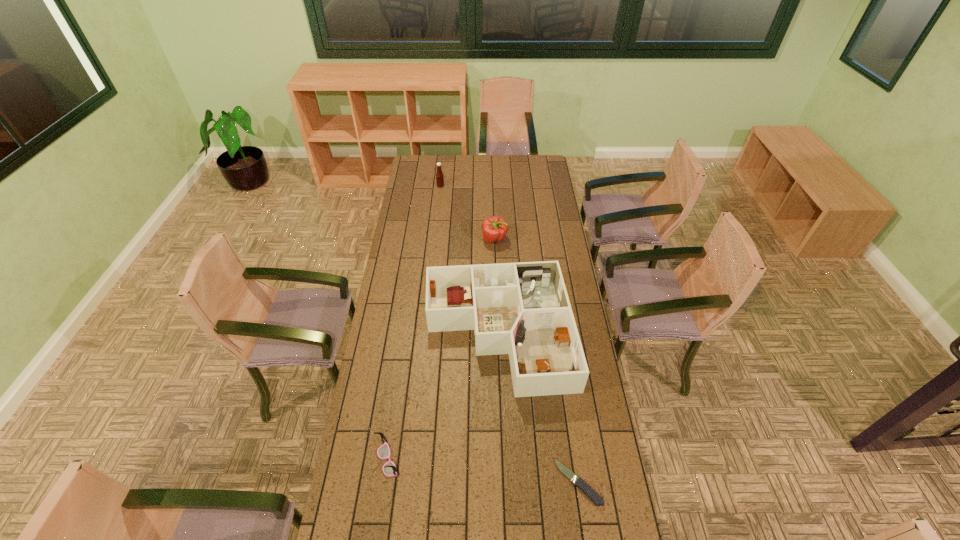
Where is `Tabasco sauce`? The image size is (960, 540). Tabasco sauce is located at coordinates (439, 175).

You are a GUI agent. You are given a task and a screenshot of the screen. Output one action in this format:
    pyautogui.click(x=<x>, y=<y>)
    Task: Click on the dollhouse
    
    Given the screenshot: What is the action you would take?
    pyautogui.click(x=522, y=309)

Locate an element on the screen. The height and width of the screenshot is (540, 960). the fourth nearest object is located at coordinates (494, 229).

The width and height of the screenshot is (960, 540). What are the coordinates of `the leftmost object` in the screenshot? It's located at (389, 469).

The image size is (960, 540). What are the coordinates of `the second shortest object` in the screenshot? It's located at (389, 469).

Locate an element on the screen. This screenshot has width=960, height=540. steak knife is located at coordinates (583, 486).

Find the location of `vacant point located 0.400m on the right of the Tabasco sauce`. vacant point located 0.400m on the right of the Tabasco sauce is located at coordinates (511, 186).

This screenshot has height=540, width=960. I want to click on vacant region located on the back of the dollhouse, so click(494, 231).

Identify the location of vacant space situated on the back of the fourth nearest object. This screenshot has height=540, width=960. (492, 194).

Find the location of a particular element. This screenshot has height=540, width=960. vacant area situated 0.150m on the back of the spectacles is located at coordinates (396, 403).